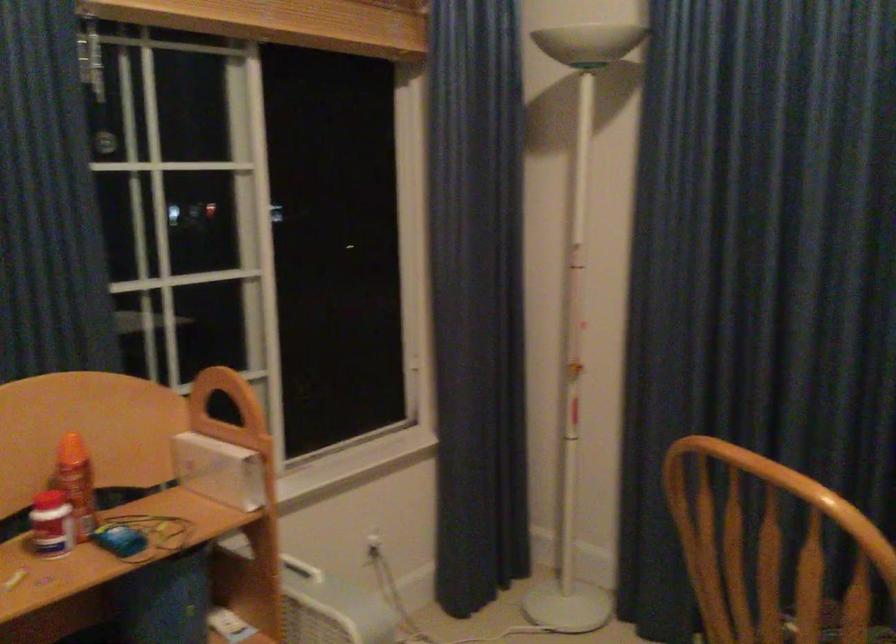
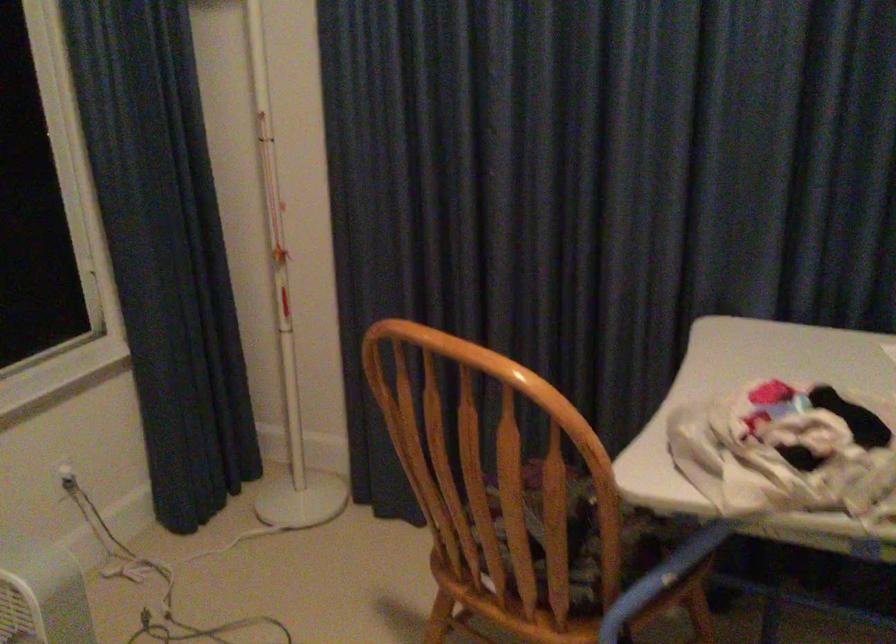
Question: The camera is either moving clockwise (left) or counter-clockwise (right) around the object. The first image is from the beginning of the video and the second image is from the end. Is the camera moving left or right when shooting the video?

Choices:
 (A) Left
 (B) Right

Answer: (A)